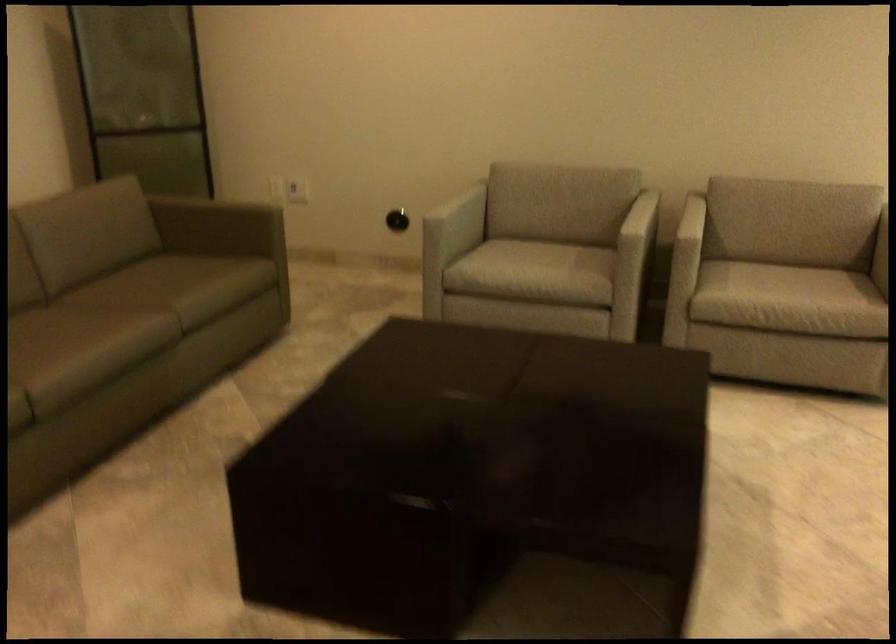
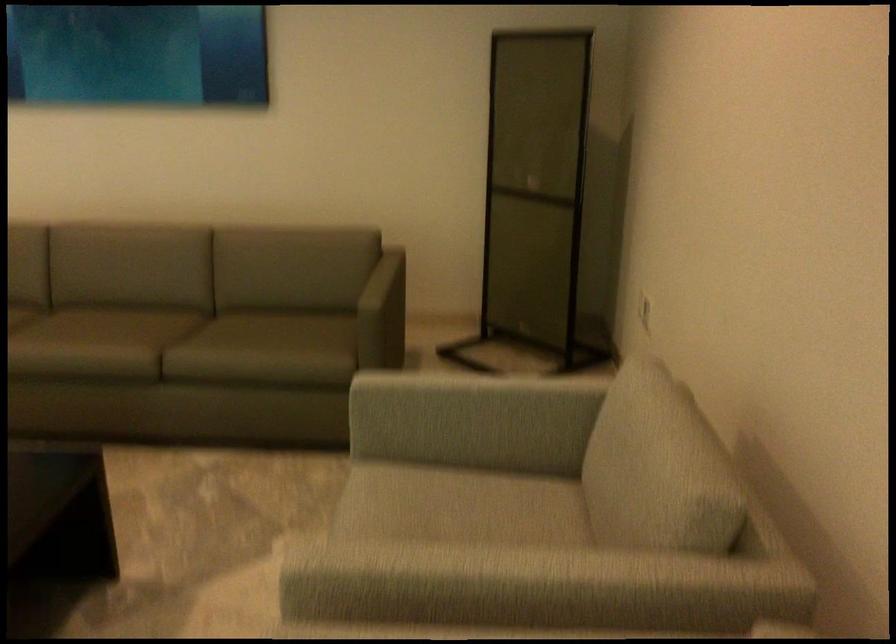
Locate, in the second image, the point that corresponds to point 166,117 in the first image.

(536, 194)